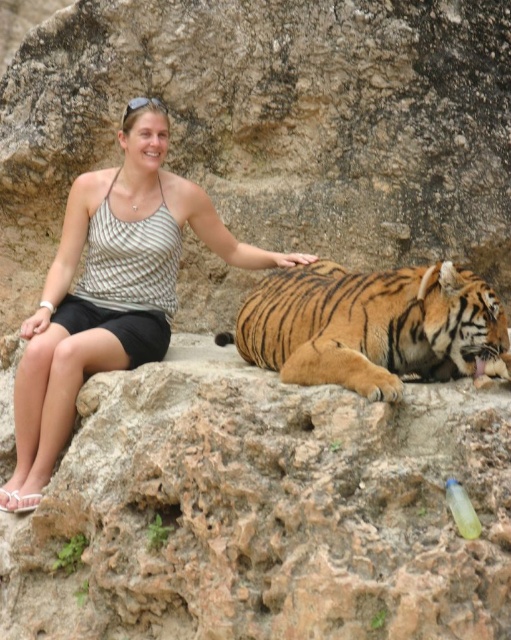
Between orange striped tiger at lower right and translucent yellow bottle at lower right, which one has more height?

orange striped tiger at lower right is taller.

What do you see at coordinates (369, 326) in the screenshot? The height and width of the screenshot is (640, 511). I see `orange striped tiger at lower right` at bounding box center [369, 326].

Does point (471, 349) lie behind point (456, 502)?

Yes, it is behind point (456, 502).

Where is `orange striped tiger at lower right`? The height and width of the screenshot is (640, 511). orange striped tiger at lower right is located at coordinates (369, 326).

Is striped fabric tank top at center positioned at the back of translucent yellow bottle at lower right?

Yes.

Who is more forward, (142, 212) or (471, 531)?

Point (471, 531) is in front.

Where is `striped fabric tank top at center`? striped fabric tank top at center is located at coordinates (110, 289).

At what (x,y) coordinates should I click in order to perform the action: click on striped fabric tank top at center. Please return your answer as a coordinate pair (x, y). This screenshot has height=640, width=511. Looking at the image, I should click on (110, 289).

Looking at this image, does striped fabric tank top at center appear on the left side of orange striped tiger at lower right?

Yes, striped fabric tank top at center is to the left of orange striped tiger at lower right.

Can you confirm if striped fabric tank top at center is bigger than orange striped tiger at lower right?

Indeed, striped fabric tank top at center has a larger size compared to orange striped tiger at lower right.

Is point (90, 285) in front of point (340, 282)?

No, (90, 285) is further to viewer.

Image resolution: width=511 pixels, height=640 pixels. In order to click on striped fabric tank top at center in this screenshot , I will do `click(110, 289)`.